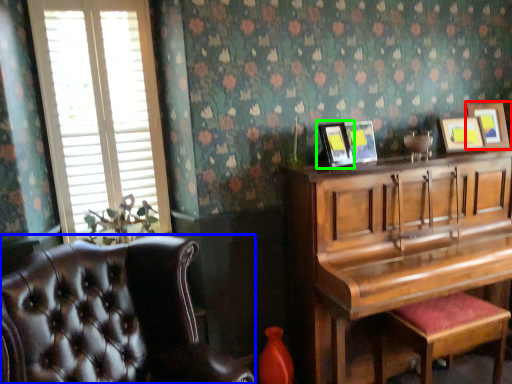
Question: Which object is the closest to the picture frame (highlighted by a red box)? Choose among these: chair (highlighted by a blue box) or picture frame (highlighted by a green box).

Choices:
 (A) chair
 (B) picture frame

Answer: (B)